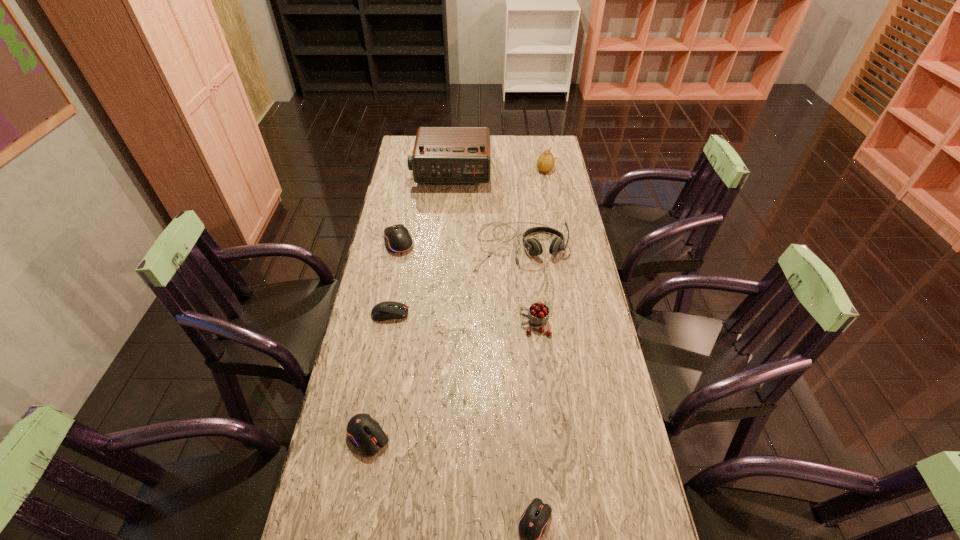
This screenshot has width=960, height=540. I want to click on empty space between the radio receiver and the fourth shortest object, so click(x=425, y=207).

Find the location of a particular element. object identified as the sixth closest to the brown pear is located at coordinates (364, 432).

You are a GUI agent. You are given a task and a screenshot of the screen. Output one action in this format:
    pyautogui.click(x=<x>, y=<y>)
    Task: Click on the fourth closest object to the smallest black computer mouse
    The width and height of the screenshot is (960, 540).
    Given the screenshot: What is the action you would take?
    pyautogui.click(x=532, y=245)

Find the location of a particular element. Image resolution: width=960 pixels, height=540 pixels. computer mouse that is the fourth closest one to the headset is located at coordinates (532, 524).

Locate an element on the screen. The width and height of the screenshot is (960, 540). the closest computer mouse to the cherry is located at coordinates (387, 310).

Where is `the second closest black computer mouse to the smallest black computer mouse`? The height and width of the screenshot is (540, 960). the second closest black computer mouse to the smallest black computer mouse is located at coordinates (398, 239).

Find the location of a particular element. The height and width of the screenshot is (540, 960). black computer mouse that is the second nearest to the dark computer equipment is located at coordinates (364, 432).

This screenshot has width=960, height=540. Find the location of `free region that satisfies the following two spatial constraints: 1. on the button of the second nearest black computer mouse; 2. on the right side of the dark computer equipment`. free region that satisfies the following two spatial constraints: 1. on the button of the second nearest black computer mouse; 2. on the right side of the dark computer equipment is located at coordinates (368, 437).

The width and height of the screenshot is (960, 540). I want to click on blank area in the image that satisfies the following two spatial constraints: 1. on the button of the dark computer equipment; 2. on the right side of the second farthest black computer mouse, so click(x=368, y=437).

Locate an element on the screen. vacant space that satisfies the following two spatial constraints: 1. on the front side of the seventh farthest object; 2. on the left side of the farthest computer mouse is located at coordinates (361, 437).